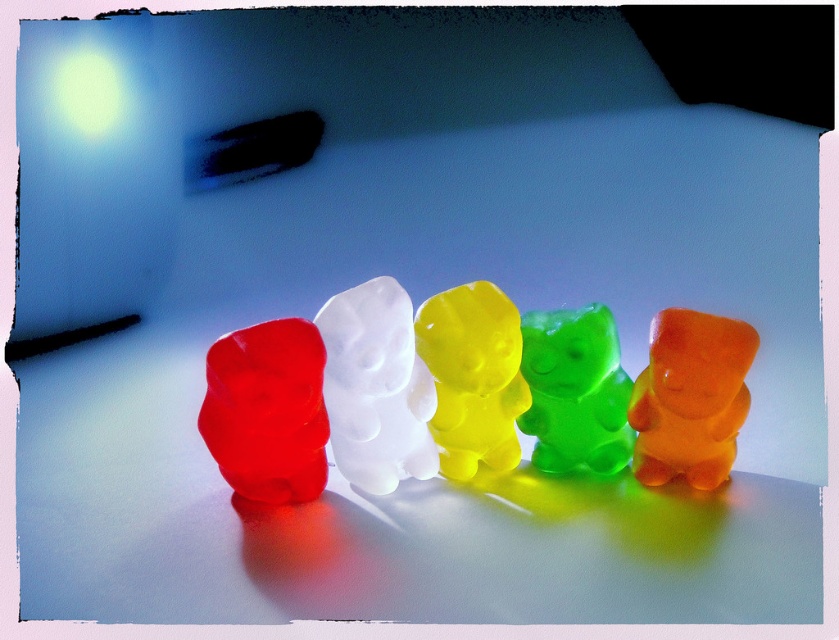
You are looking at the row of gummy bears on the reflective surface. The point marked at coordinates [376,387] is pointing to one of the bears. Which color gummy bear is located at that specific coordinate?

The point at [376,387] indicates the translucent white bear at center.

You are a child trying to pick up the translucent white bear at center and the translucent yellow bear at center. Since they are very close, can you grab both at the same time with one hand?

The translucent white bear at center is positioned under the translucent yellow bear at center, so you can grab both at the same time with one hand since they are stacked vertically.

You are a child who wants to place a small toy between the translucent white bear at center and the translucent yellow bear at center. The toy is 3 inches long. Do you think there is enough space between them to fit the toy?

The translucent white bear at center is 2.98 inches from the translucent yellow bear at center. Since the toy is 3 inches long, there is not enough space to fit the toy between them.